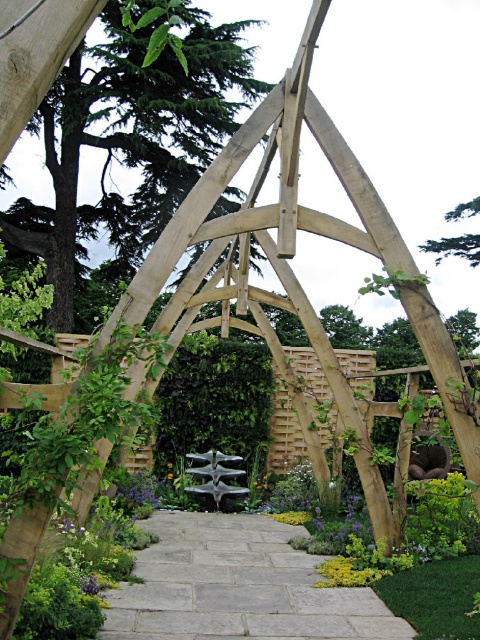
Can you confirm if gray stone path at center is thinner than yellow matte flower at center?

In fact, gray stone path at center might be wider than yellow matte flower at center.

Between point (300, 554) and point (167, 474), which one is positioned behind?

The point (167, 474) is more distant.

Identify the location of gray stone path at center. This screenshot has width=480, height=640. (238, 586).